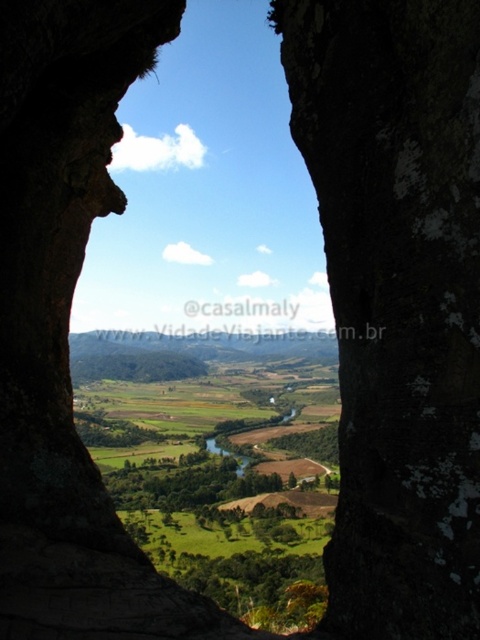
You are an explorer navigating through the valley and notice two rocks at the center of your path. The dark brown textured rock at center and the brown rough rock at center. Which rock should you step over first if you want to avoid the larger obstacle?

You should step over the brown rough rock at center first because it is larger than the dark brown textured rock at center, as the dark brown textured rock at center has a smaller size compared to brown rough rock at center.

You are a hiker standing in front of the rock opening. You see the green grassy field at center and the green grassy river at center. Which one is closer to you?

The green grassy field at center is positioned over the green grassy river at center, meaning the field is closer to you.

In the scene shown: You are standing at the rock opening and looking out into the valley. You see a green grassy field at center and a green grassy river at center. Which one is positioned to the right side of the other?

The green grassy field at center is to the right of the green grassy river at center.